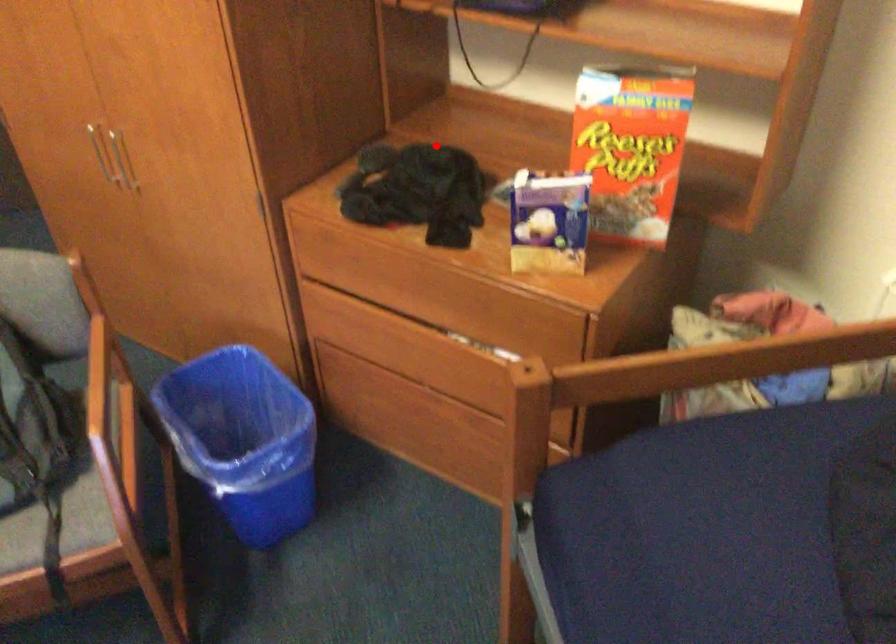
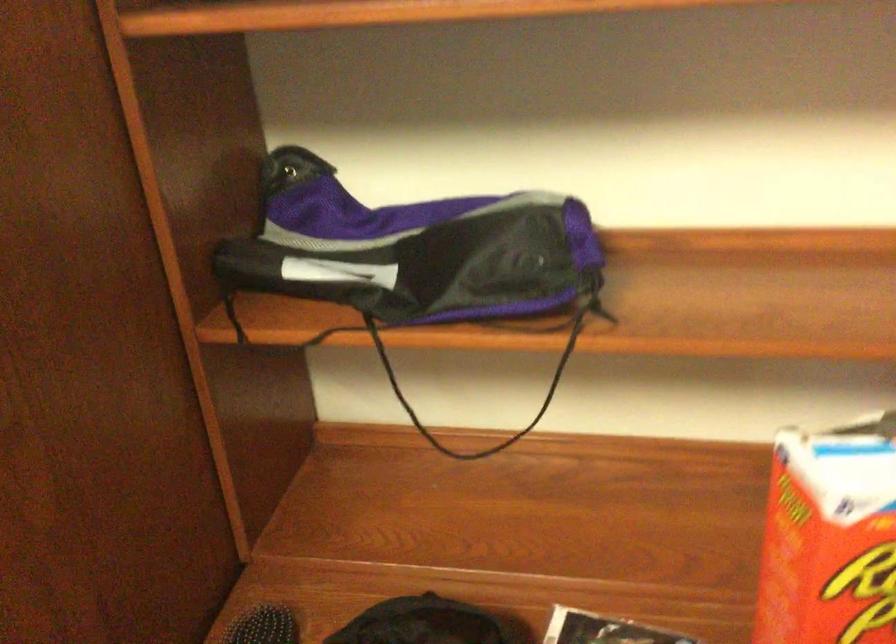
Question: I am providing you with two images of the same scene from different viewpoints. Given a red point in image1, look at the same physical point in image2. Is it:

Choices:
 (A) Closer to the viewpoint
 (B) Farther from the viewpoint

Answer: (A)